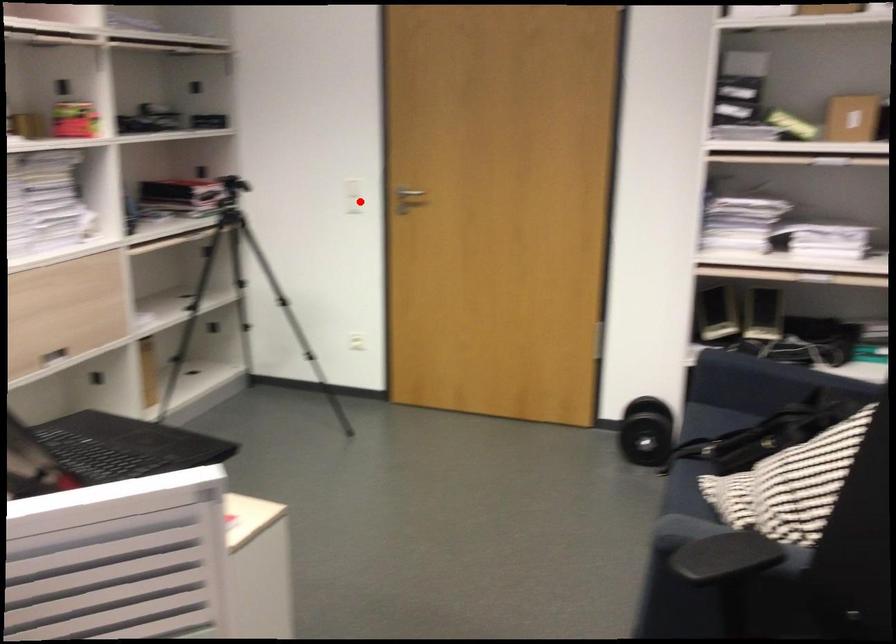
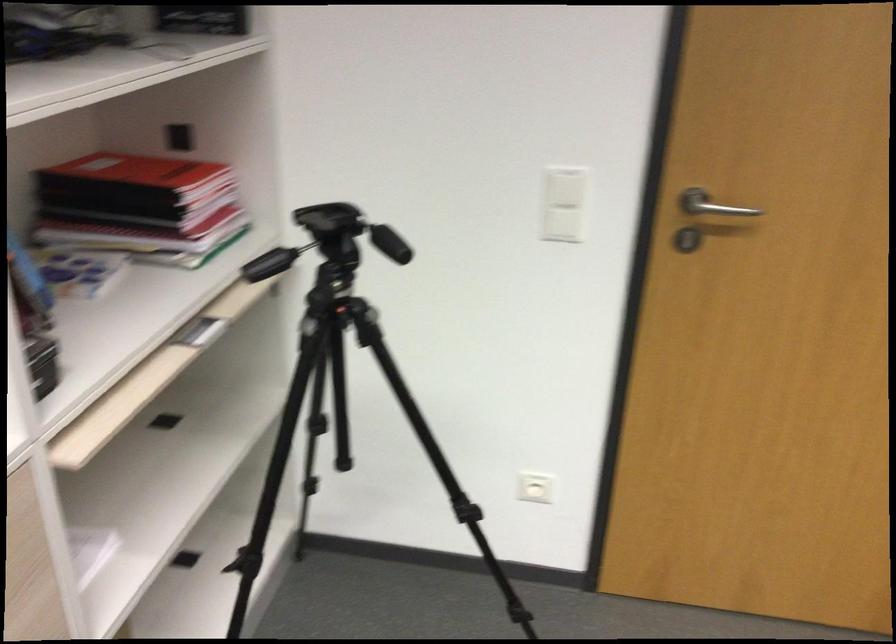
Question: A red point is marked in image1. In image2, is the corresponding 3D point closer to the camera or farther? Reply with the corresponding letter.

Choices:
 (A) The corresponding 3D point is closer.
 (B) The corresponding 3D point is farther.

Answer: (A)